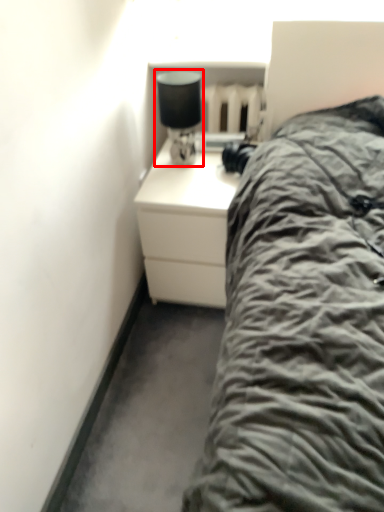
Question: From the image's perspective, what is the correct spatial relationship of bedside lamp (annotated by the red box) in relation to chest of drawers?

Choices:
 (A) above
 (B) below

Answer: (A)